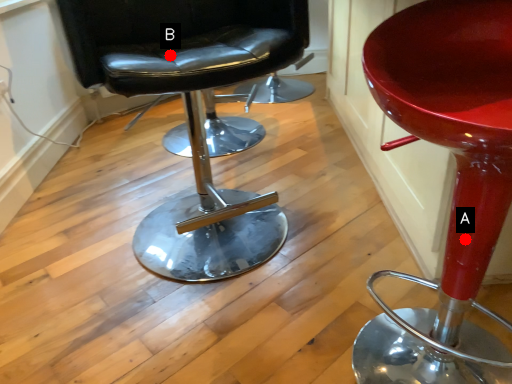
Question: Two points are circled on the image, labeled by A and B beside each circle. Which point is closer to the camera taking this photo?

Choices:
 (A) A is closer
 (B) B is closer

Answer: (A)